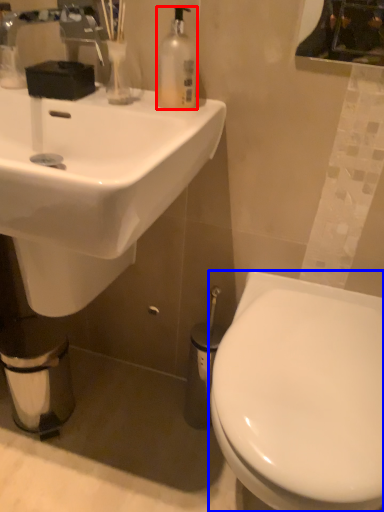
Question: Which object is closer to the camera taking this photo, bottle (highlighted by a red box) or toilet (highlighted by a blue box)?

Choices:
 (A) bottle
 (B) toilet

Answer: (B)